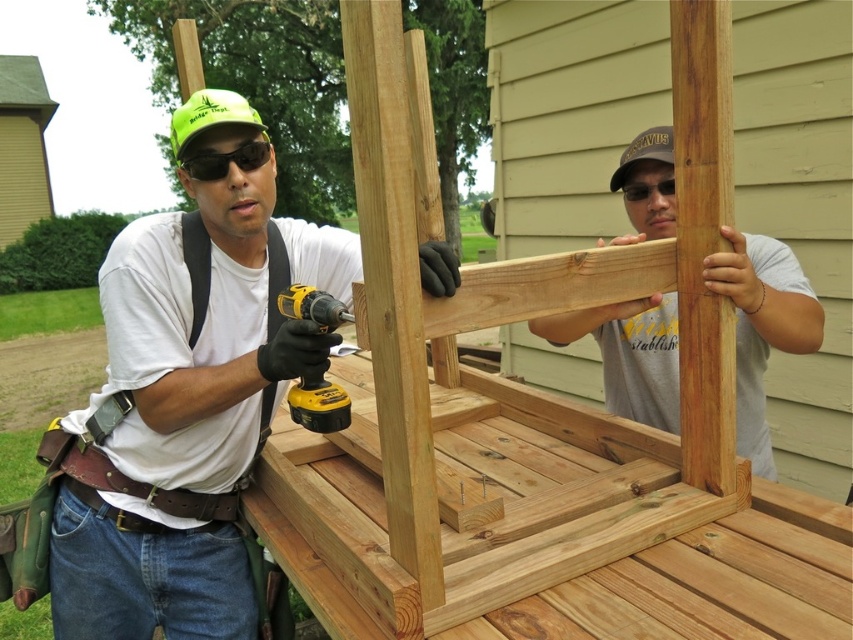
You are standing at the origin point in the image. There is a matte black drill at center. Can you tell me what object is located at the point with coordinates (187, 413)?

The point with coordinates (187, 413) is on the matte black drill at center.

You are a contractor working on a construction site. You need to determine the relative height of the matte black drill at center and the light brown wood at center to ensure proper placement. Which object is taller?

The matte black drill at center is much taller than the light brown wood at center according to the description.